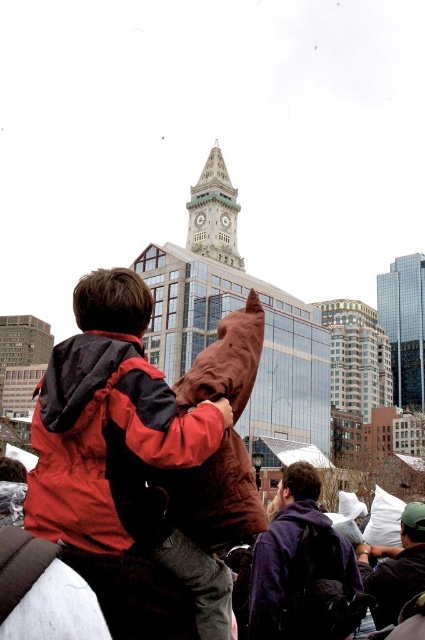
From the picture: You are an architect analyzing the urban skyline. Given the presence of the glassy reflective skyscraper at upper center and the green stone clock tower at center, which structure would cast a longer shadow during midday? Explain your reasoning based on their sizes and positions.

The glassy reflective skyscraper at upper center would cast a longer shadow because it has a larger size compared to the green stone clock tower at center, and taller structures generally cast longer shadows when the sun is directly overhead at midday.

Looking at this image, you are a drone operator who needs to fly a drone from your current position to the glassy reflective skyscraper at upper center. What is the approximate distance you need to cover?

The distance of glassy reflective skyscraper at upper center from camera is 444.04 feet, so you need to cover approximately 444 feet.